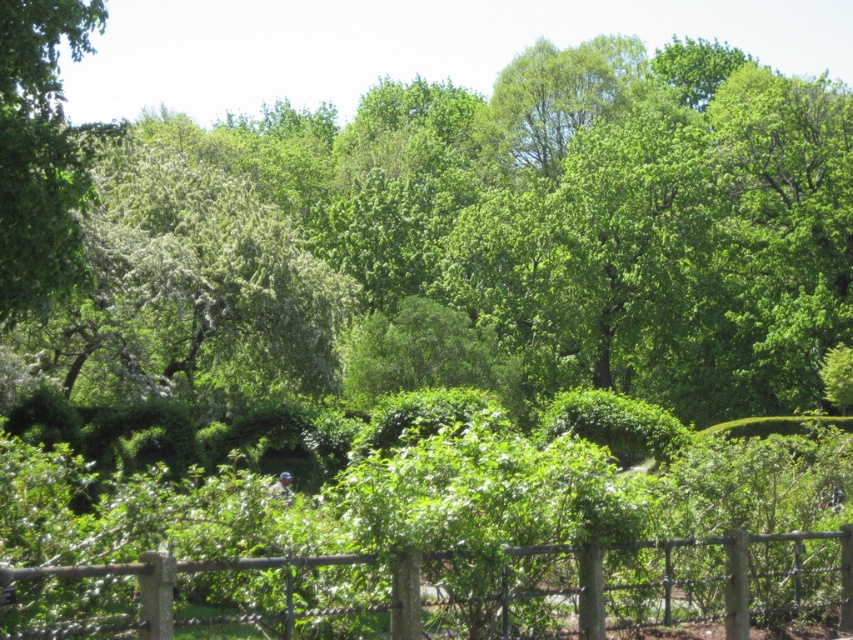
Question: Which point is closer to the camera taking this photo?

Choices:
 (A) (740, 593)
 (B) (44, 84)

Answer: (A)

Question: Does green leafy tree at left appear on the right side of rustic wood fence at lower center?

Choices:
 (A) no
 (B) yes

Answer: (A)

Question: Considering the relative positions of green leafy tree at left and rustic wood fence at lower center in the image provided, where is green leafy tree at left located with respect to rustic wood fence at lower center?

Choices:
 (A) left
 (B) right

Answer: (A)

Question: Is green leafy tree at left thinner than rustic wood fence at lower center?

Choices:
 (A) no
 (B) yes

Answer: (A)

Question: Which object is farther from the camera taking this photo?

Choices:
 (A) rustic wood fence at lower center
 (B) green leafy tree at left

Answer: (B)